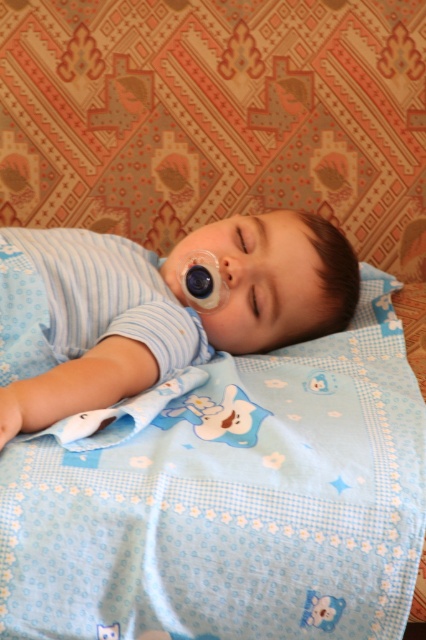
You are a parent checking on your baby. You see the blue fabric blanket at center and the blue soft fabric at center. Which one is positioned more to the right side?

The blue fabric blanket at center is positioned more to the right side than the blue soft fabric at center.

You are a parent trying to place a small stuffed animal on the bed where the baby is sleeping. You have two options for placement based on coordinates given in the image. The first option is at point (353, 632) and the second is at point (86, 349). Which point is closer to the baby?

Point (353, 632) is in front of point (86, 349), so it is closer to the baby.

You are a parent holding a baby toy and want to place it near the baby sleeping on the bed. The baby is at point (160,470). If you can reach up to 36 inches, can you place the toy safely without getting too close to the baby?

The distance between you and the baby at point (160,470) is 34.05 inches. Since your reach is 36 inches, you can safely place the toy as the distance is within your reach range.